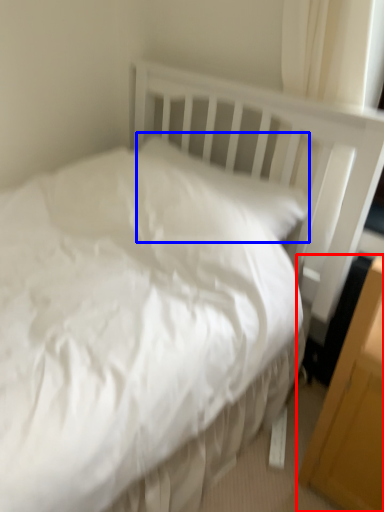
Question: Among these objects, which one is farthest to the camera, file cabinet (highlighted by a red box) or pillow (highlighted by a blue box)?

Choices:
 (A) file cabinet
 (B) pillow

Answer: (B)